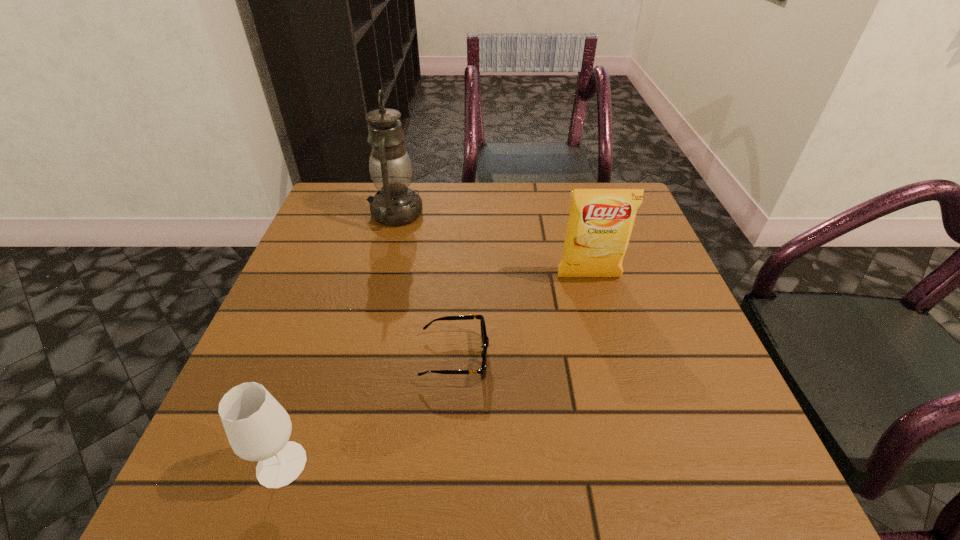
Locate an element on the screen. vacant space situated on the right of the nearest object is located at coordinates (573, 464).

Where is `free spot located on the front-facing side of the shortest object`? free spot located on the front-facing side of the shortest object is located at coordinates (613, 357).

The height and width of the screenshot is (540, 960). What are the coordinates of `object located in the far edge section of the desktop` in the screenshot? It's located at (390, 167).

The height and width of the screenshot is (540, 960). I want to click on object situated at the near edge, so click(258, 428).

Identify the location of oil lamp present at the left edge. (390, 167).

Locate an element on the screen. This screenshot has width=960, height=540. glass situated at the left edge is located at coordinates (258, 428).

I want to click on object that is positioned at the right edge, so click(600, 223).

At what (x,y) coordinates should I click in order to perform the action: click on object that is at the far left corner. Please return your answer as a coordinate pair (x, y). The height and width of the screenshot is (540, 960). Looking at the image, I should click on (390, 167).

I want to click on object located at the near left corner, so click(258, 428).

Where is `blank space at the far edge`? The width and height of the screenshot is (960, 540). blank space at the far edge is located at coordinates (434, 222).